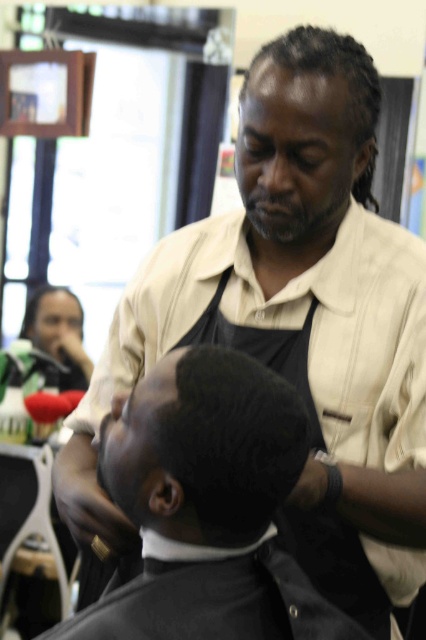
You are a customer in the barbershop and want to check your phone while waiting for your turn. The barber is currently cutting the sleek black hair at center. Where should you place your matte black phone at upper left to avoid it being in the way?

You should place the matte black phone at upper left below the sleek black hair at center since the sleek black hair at center is located above the matte black phone at upper left, so placing it below ensures it won not obstruct the barber.

You are a customer in the barbershop and want to check your phone while waiting for your turn. The barber is currently cutting the sleek black hair at center. Can you see the matte black phone at upper left from your current position?

The sleek black hair at center is smaller than the matte black phone at upper left, so it might block your view of the matte black phone at upper left depending on their positions. However, since the phone is larger, it could still be visible if positioned higher or to the side.

In the barbershop scene, you notice a black textured hair at center and a matte black phone at upper left. Which object is positioned to the right of the other?

The black textured hair at center is to the right of the matte black phone at upper left.